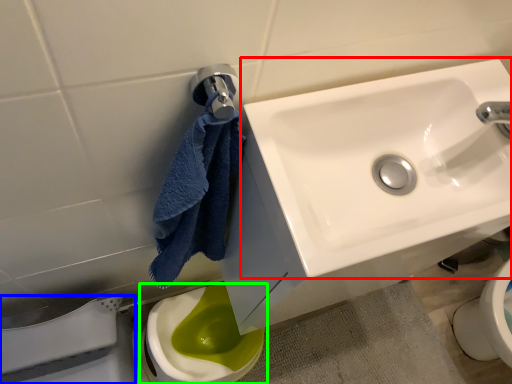
Question: Considering the real-world distances, which object is farthest from sink (highlighted by a red box)? porcelain (highlighted by a blue box) or toilet (highlighted by a green box)?

Choices:
 (A) porcelain
 (B) toilet

Answer: (B)